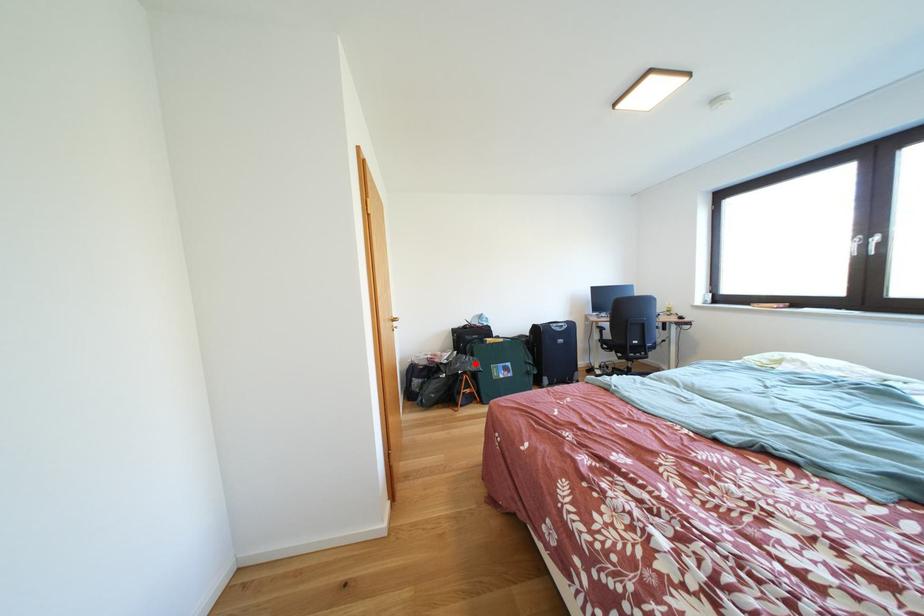
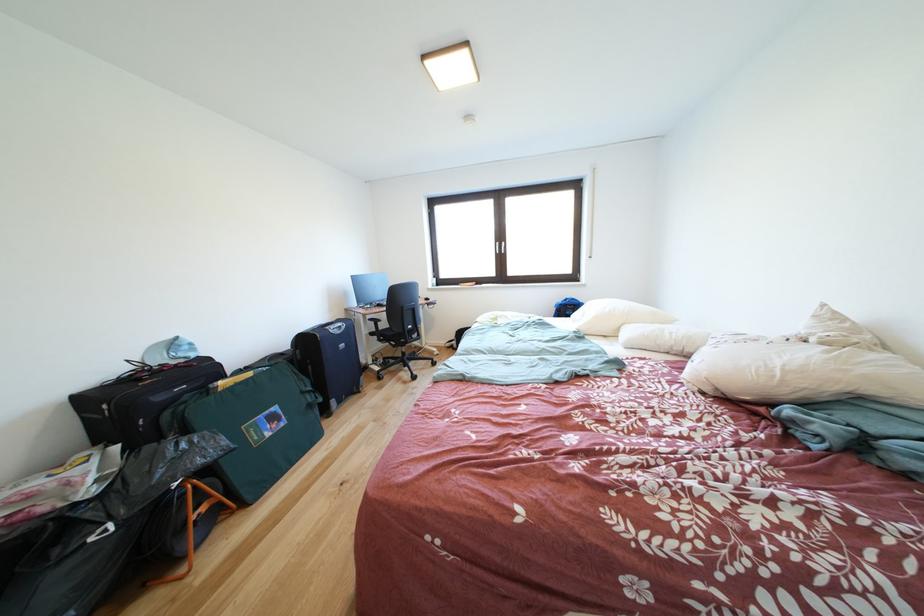
Question: A red point is marked in image1. In image2, is the corresponding 3D point closer to the camera or farther? Reply with the corresponding letter.

Choices:
 (A) The corresponding 3D point is closer.
 (B) The corresponding 3D point is farther.

Answer: (A)